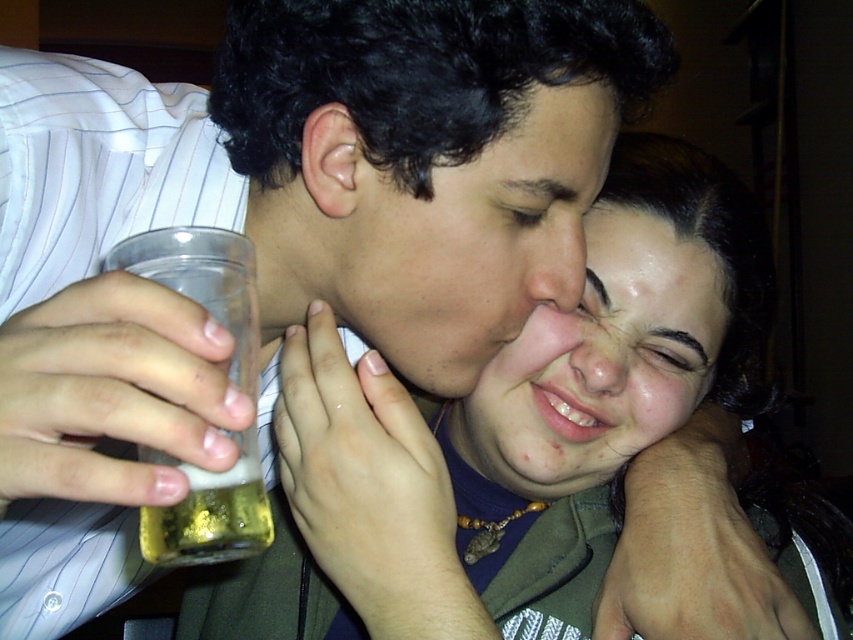
Who is positioned more to the right, oily skin face at center or glossy skin forehead at upper center?

glossy skin forehead at upper center is more to the right.

Does oily skin face at center have a larger size compared to glossy skin forehead at upper center?

Correct, oily skin face at center is larger in size than glossy skin forehead at upper center.

Does point (675, 344) come in front of point (683, 278)?

No, it is behind (683, 278).

Image resolution: width=853 pixels, height=640 pixels. Find the location of `oily skin face at center`. oily skin face at center is located at coordinates click(601, 362).

Who is positioned more to the right, clear plastic cup at lower left or translucent plastic cup at lower left?

Positioned to the right is translucent plastic cup at lower left.

Between point (202, 497) and point (173, 524), which one is positioned behind?

The point (202, 497) is behind.

Where is `clear plastic cup at lower left`? The width and height of the screenshot is (853, 640). clear plastic cup at lower left is located at coordinates (209, 512).

Looking at this image, is glossy skin forehead at upper center closer to camera compared to translucent plastic cup at lower left?

No, glossy skin forehead at upper center is further to the viewer.

The width and height of the screenshot is (853, 640). What do you see at coordinates (648, 259) in the screenshot?
I see `glossy skin forehead at upper center` at bounding box center [648, 259].

Image resolution: width=853 pixels, height=640 pixels. Identify the location of glossy skin forehead at upper center. (648, 259).